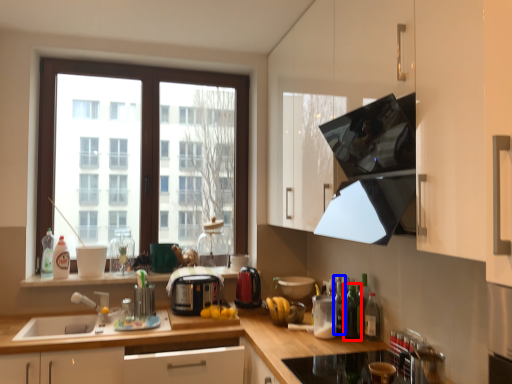
Question: Which object appears farthest to the camera in this image, bottle (highlighted by a red box) or bottle (highlighted by a blue box)?

Choices:
 (A) bottle
 (B) bottle

Answer: (B)